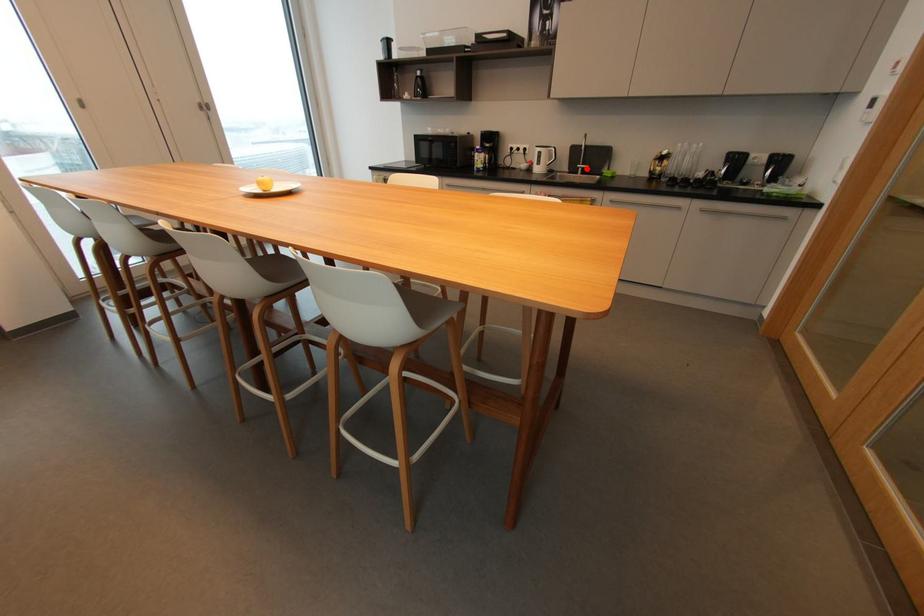
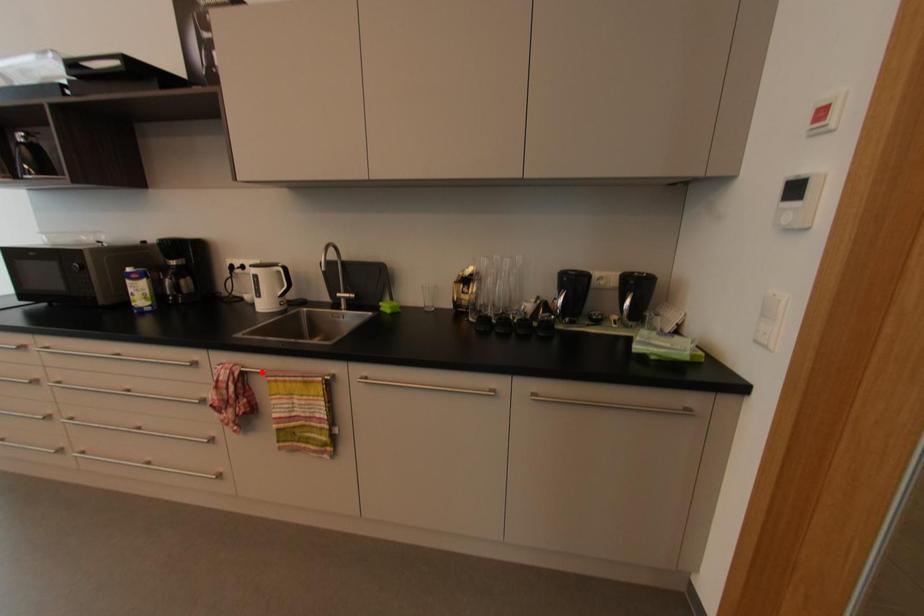
I am providing you with two images of the same scene from different viewpoints. A red point is marked on the first image and another point is marked on the second image. Are the points marked in image1 and image2 representing the same 3D position?

No